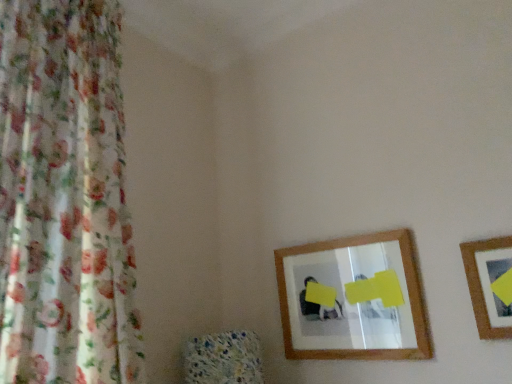
Question: Considering the relative positions of floral fabric curtain at left and wooden picture frame at right in the image provided, is floral fabric curtain at left behind wooden picture frame at right?

Choices:
 (A) no
 (B) yes

Answer: (A)

Question: Is floral fabric curtain at left bigger than wooden picture frame at right?

Choices:
 (A) yes
 (B) no

Answer: (A)

Question: Does floral fabric curtain at left have a greater height compared to wooden picture frame at right?

Choices:
 (A) yes
 (B) no

Answer: (A)

Question: Can you confirm if floral fabric curtain at left is thinner than wooden picture frame at right?

Choices:
 (A) no
 (B) yes

Answer: (A)

Question: From the image's perspective, is floral fabric curtain at left located above wooden picture frame at right?

Choices:
 (A) yes
 (B) no

Answer: (A)

Question: From a real-world perspective, is wooden-framed mirror at center above or below wooden picture frame at right?

Choices:
 (A) above
 (B) below

Answer: (A)

Question: Is point (352, 273) closer or farther from the camera than point (494, 279)?

Choices:
 (A) closer
 (B) farther

Answer: (B)

Question: Based on their sizes in the image, would you say wooden-framed mirror at center is bigger or smaller than wooden picture frame at right?

Choices:
 (A) small
 (B) big

Answer: (B)

Question: Would you say wooden-framed mirror at center is inside or outside wooden picture frame at right?

Choices:
 (A) inside
 (B) outside

Answer: (B)

Question: Is wooden-framed mirror at center situated inside floral fabric curtain at left or outside?

Choices:
 (A) inside
 (B) outside

Answer: (B)

Question: Is wooden-framed mirror at center taller or shorter than floral fabric curtain at left?

Choices:
 (A) short
 (B) tall

Answer: (A)

Question: From a real-world perspective, is wooden-framed mirror at center positioned above or below floral fabric curtain at left?

Choices:
 (A) above
 (B) below

Answer: (B)

Question: Looking at their shapes, would you say wooden-framed mirror at center is wider or thinner than floral fabric curtain at left?

Choices:
 (A) wide
 (B) thin

Answer: (B)

Question: Based on their positions, is floral fabric curtain at left located to the left or right of wooden picture frame at right?

Choices:
 (A) left
 (B) right

Answer: (A)

Question: From a real-world perspective, is floral fabric curtain at left above or below wooden picture frame at right?

Choices:
 (A) above
 (B) below

Answer: (A)